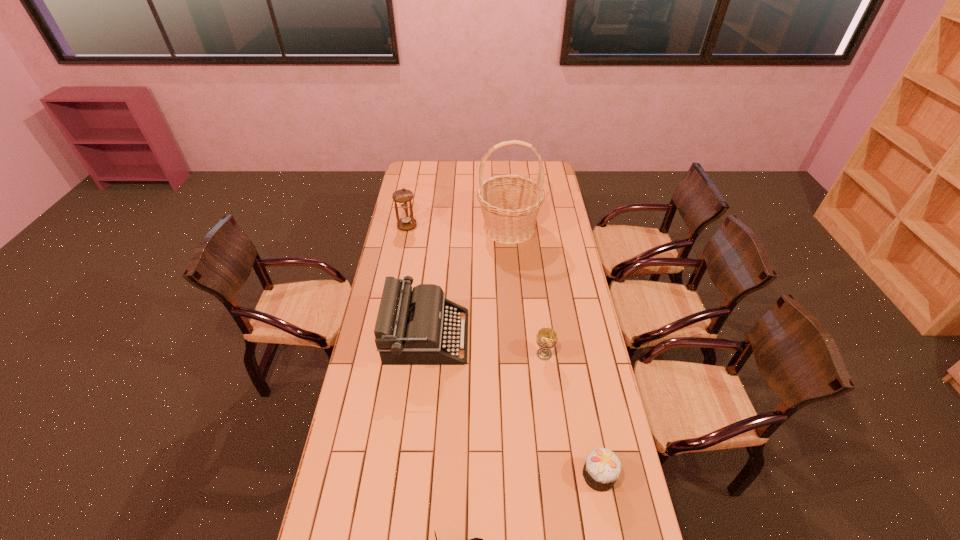
Identify the location of blank space located 0.100m on the left of the cupcake. The width and height of the screenshot is (960, 540). (551, 475).

Locate an element on the screen. hourglass positioned at the left edge is located at coordinates (403, 196).

Image resolution: width=960 pixels, height=540 pixels. I want to click on typewriter located at the left edge, so (x=414, y=327).

I want to click on basket located in the right edge section of the desktop, so click(x=510, y=204).

Find the location of a particular element. Image resolution: width=960 pixels, height=540 pixels. cupcake located in the right edge section of the desktop is located at coordinates (602, 467).

In the image, there is a desktop. In order to click on vacant space at the far edge in this screenshot , I will do pyautogui.click(x=437, y=172).

Where is `vacant area at the left edge`? Image resolution: width=960 pixels, height=540 pixels. vacant area at the left edge is located at coordinates (410, 235).

In the image, there is a desktop. Identify the location of blank space at the right edge. (555, 197).

Locate an element on the screen. free spot between the typewriter and the chalice is located at coordinates (486, 345).

This screenshot has width=960, height=540. What are the coordinates of `vacant area that lies between the rightmost object and the chalice` in the screenshot? It's located at (571, 415).